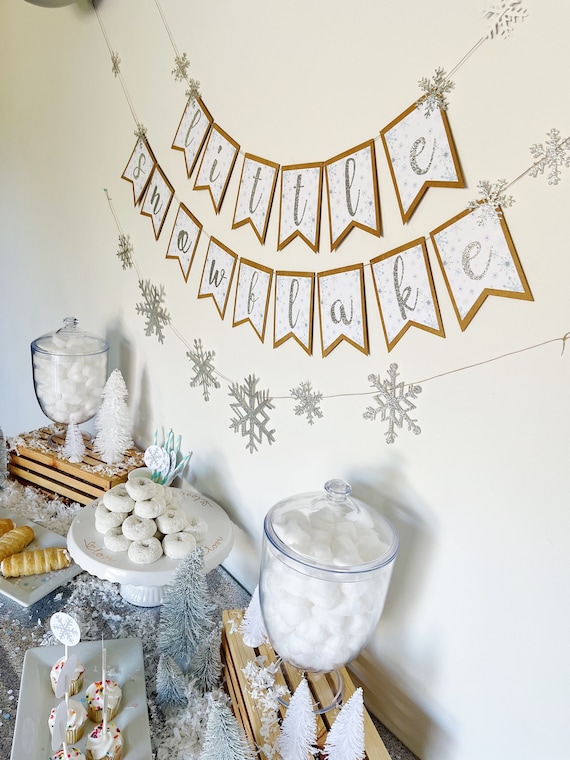
What are the coordinates of `plates` in the screenshot? It's located at (28, 584), (35, 670).